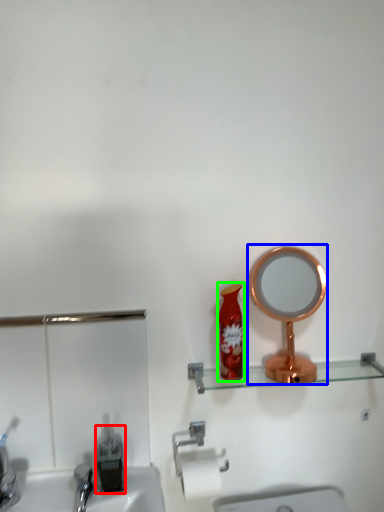
Question: Which object is the farthest from bottle (highlighted by a red box)? Choose among these: mirror (highlighted by a blue box) or toiletry (highlighted by a green box).

Choices:
 (A) mirror
 (B) toiletry

Answer: (A)